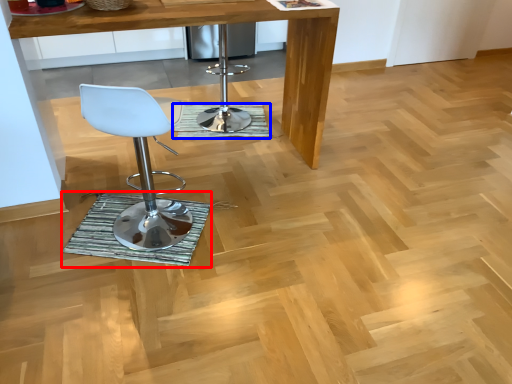
Question: Which of the following is the closest to the observer, mat (highlighted by a red box) or mat (highlighted by a blue box)?

Choices:
 (A) mat
 (B) mat

Answer: (A)